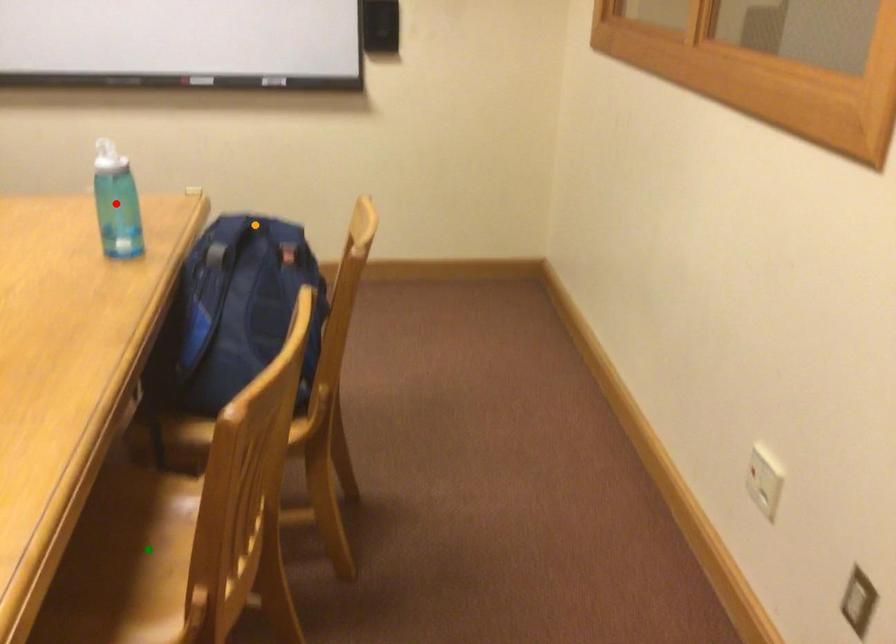
Order these from nearest to farthest:
1. green point
2. red point
3. orange point

red point, orange point, green point